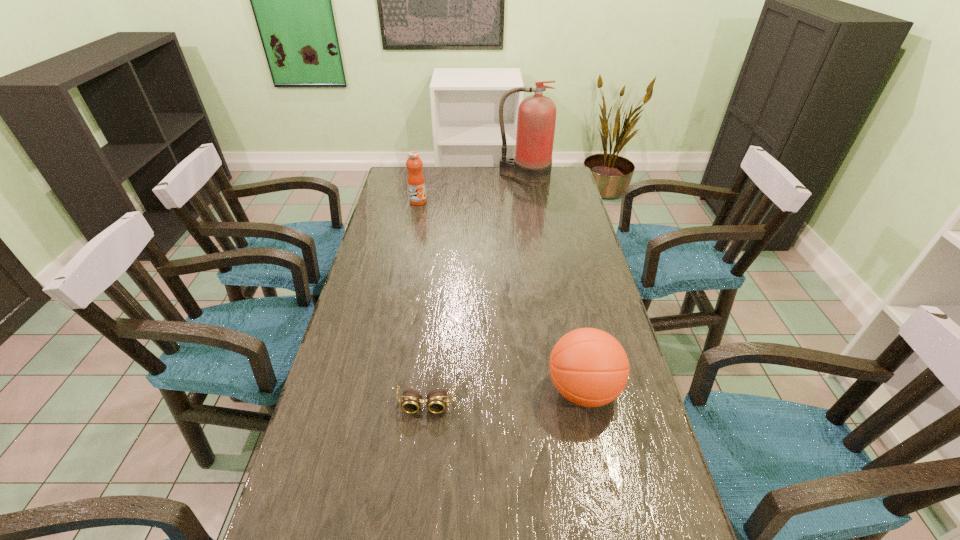
Where is `the farthest object`? This screenshot has height=540, width=960. the farthest object is located at coordinates (531, 166).

At what (x,y) coordinates should I click in order to perform the action: click on fire extinguisher. Please return your answer as a coordinate pair (x, y). This screenshot has width=960, height=540. Looking at the image, I should click on (531, 166).

You are a GUI agent. You are given a task and a screenshot of the screen. Output one action in this format:
    pyautogui.click(x=<x>, y=<y>)
    Task: Click on the leftmost object
    
    Given the screenshot: What is the action you would take?
    pyautogui.click(x=416, y=182)

Find the location of a particular element. This screenshot has height=540, width=960. the third nearest object is located at coordinates point(416,182).

You are a GUI agent. You are given a task and a screenshot of the screen. Output one action in this format:
    pyautogui.click(x=<x>, y=<y>)
    Task: Click on the basketball
    The image size is (960, 540).
    Given the screenshot: What is the action you would take?
    pyautogui.click(x=589, y=367)

Where is `the shortest object`? The height and width of the screenshot is (540, 960). the shortest object is located at coordinates (436, 400).

In order to click on goggles in this screenshot , I will do `click(436, 400)`.

Identify the location of free region located 0.060m at the nozzle of the fire extinguisher. The height and width of the screenshot is (540, 960). click(x=526, y=193).

Where is `vacant space positioned 0.290m on the front label of the leftmost object`? vacant space positioned 0.290m on the front label of the leftmost object is located at coordinates (409, 251).

Locate an element on the screen. Image resolution: width=960 pixels, height=540 pixels. vacant space located 0.160m on the front of the basketball is located at coordinates (604, 492).